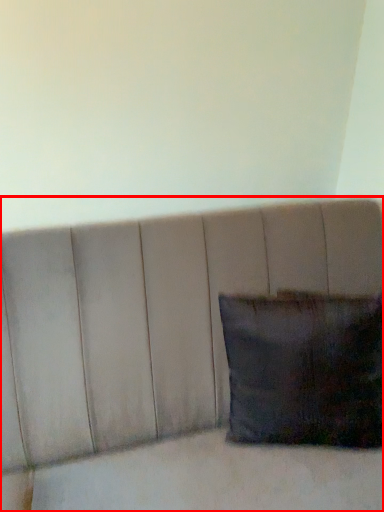
Question: From the image's perspective, what is the correct spatial positioning of furniture (annotated by the red box) in reference to pillow?

Choices:
 (A) below
 (B) above

Answer: (A)